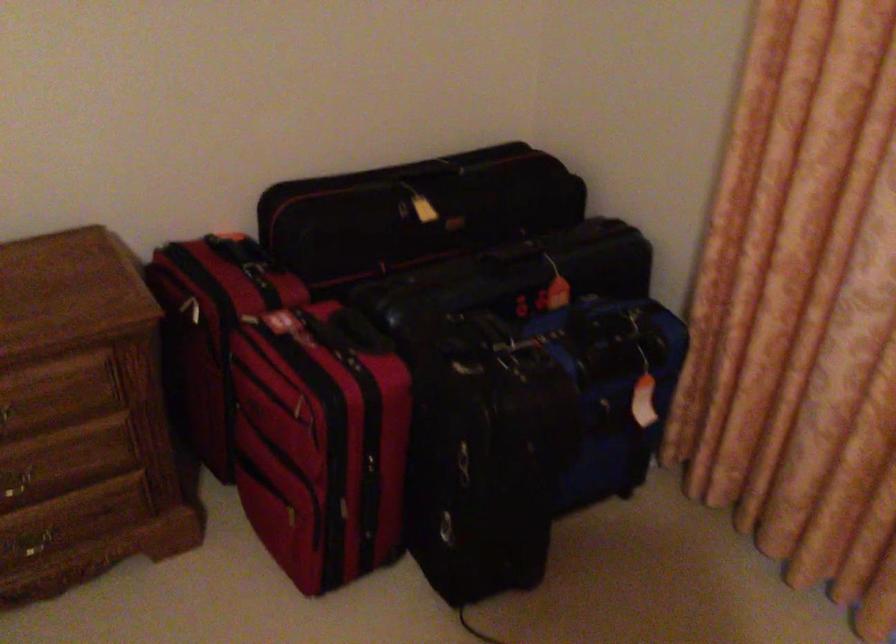
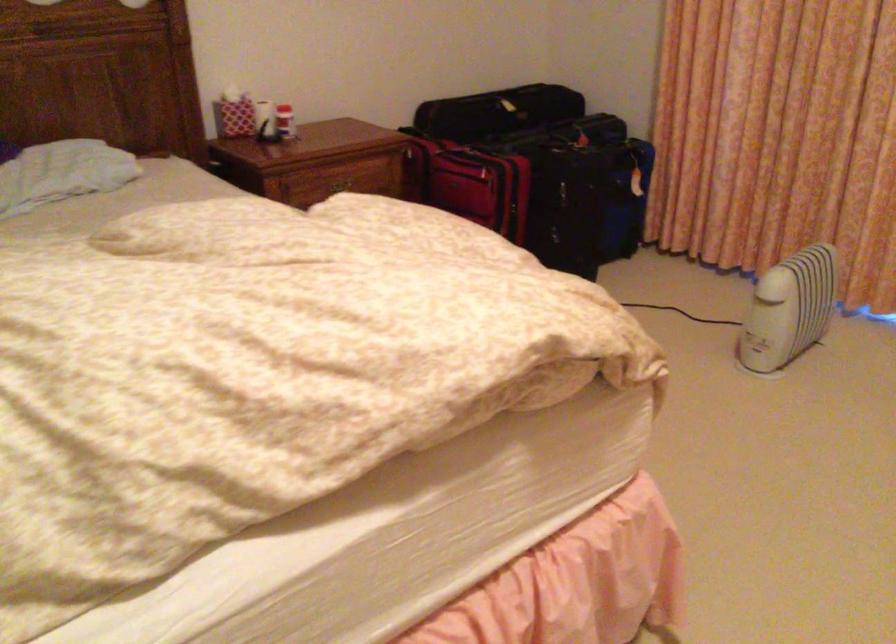
Where in the second image is the point corresponding to (613,435) from the first image?

(625, 199)